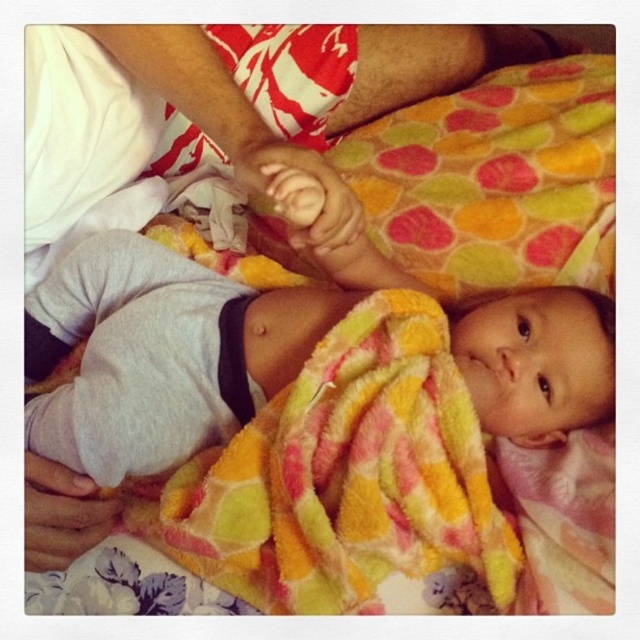
You are a photographer standing in front of the multicolored fleece blanket at center. You want to take a closeup photo of the blanket without moving the camera. What is the minimum focal length lens you need to use if the blanket is 21.62 inches away from you?

The minimum focal length lens required is 21.62 inches because the distance between the multicolored fleece blanket at center and the viewer is 21.62 inches, so a lens with at least that focal length would be needed to capture the closeup without moving the camera.